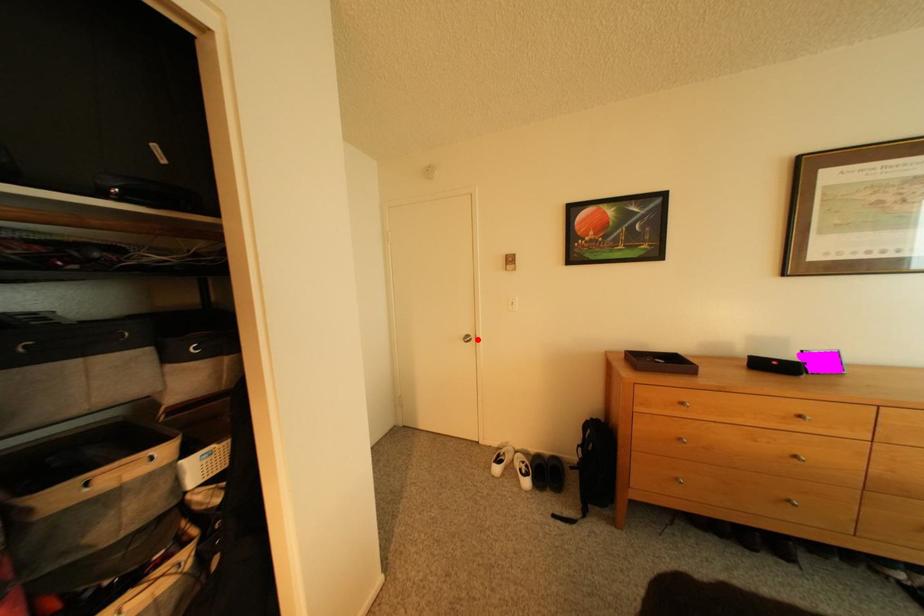
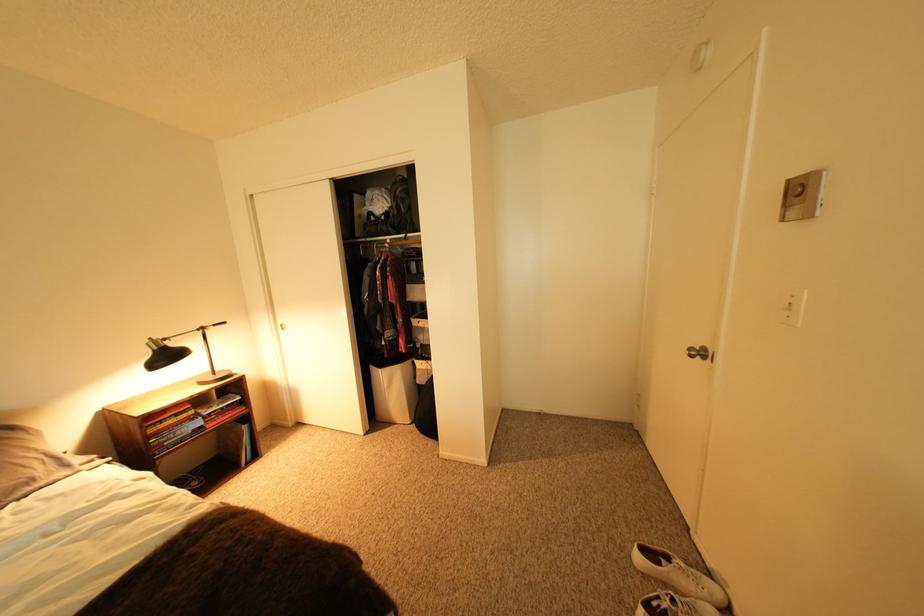
Locate, in the second image, the point that corresponds to the highlighted location in the first image.

(703, 351)